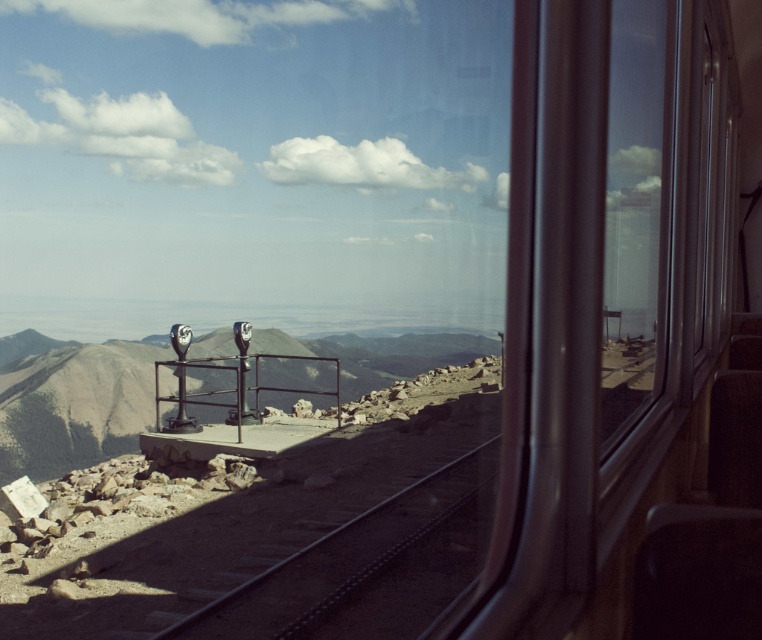
Question: Does dark brown gravel train track at center come behind transparent glass window at right?

Choices:
 (A) yes
 (B) no

Answer: (A)

Question: Can you confirm if dark brown gravel train track at center is wider than transparent glass window at right?

Choices:
 (A) yes
 (B) no

Answer: (A)

Question: Among these objects, which one is farthest from the camera?

Choices:
 (A) dark brown gravel train track at center
 (B) transparent glass window at right

Answer: (A)

Question: Which point is farther to the camera?

Choices:
 (A) transparent glass window at right
 (B) dark brown gravel train track at center

Answer: (B)

Question: Does dark brown gravel train track at center lie behind transparent glass window at right?

Choices:
 (A) yes
 (B) no

Answer: (A)